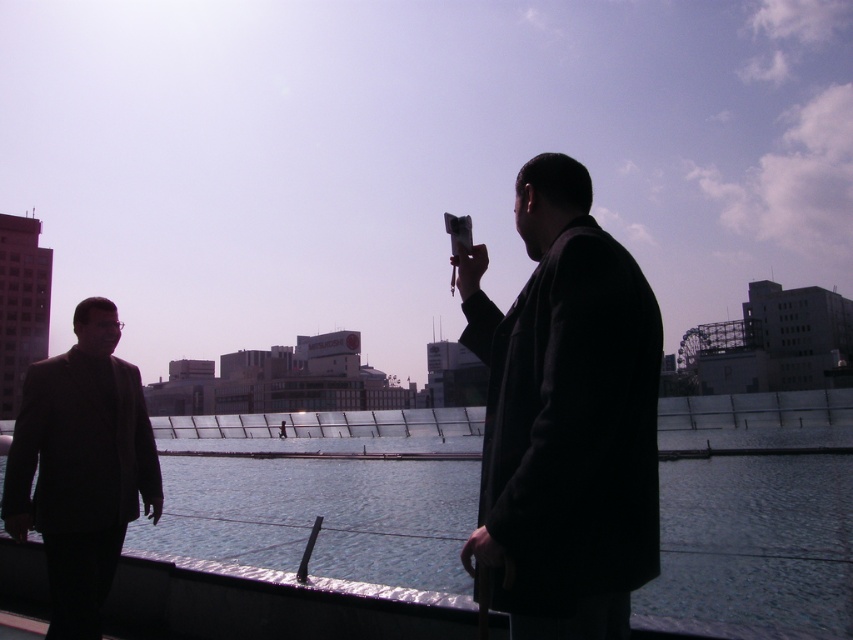
Question: Does dark matte coat at right have a smaller size compared to matte black suit at left?

Choices:
 (A) no
 (B) yes

Answer: (A)

Question: Observing the image, what is the correct spatial positioning of dark matte coat at right in reference to matte black suit at left?

Choices:
 (A) right
 (B) left

Answer: (A)

Question: Which object appears farthest from the camera in this image?

Choices:
 (A) glossy concrete water at center
 (B) dark matte coat at right
 (C) matte black suit at left

Answer: (C)

Question: Based on their relative distances, which object is farther from the matte black suit at left?

Choices:
 (A) dark matte coat at right
 (B) glossy concrete water at center

Answer: (B)

Question: Is dark matte coat at right smaller than glossy concrete water at center?

Choices:
 (A) no
 (B) yes

Answer: (B)

Question: Which is farther from the matte black suit at left?

Choices:
 (A) dark matte coat at right
 (B) glossy concrete water at center

Answer: (B)